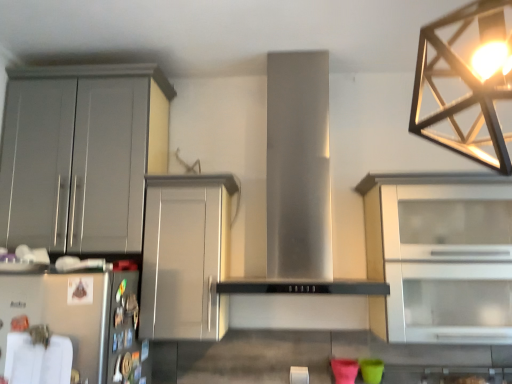
Question: Is satin silver cabinet at center, the second cabinetry when ordered from left to right, in front of or behind white glass cabinet at right, which is the 3th cabinetry in left-to-right order, in the image?

Choices:
 (A) behind
 (B) front

Answer: (A)

Question: Considering the positions of satin silver cabinet at center, which ranks as the 2th cabinetry in right-to-left order, and white glass cabinet at right, which is the 3th cabinetry in left-to-right order, in the image, is satin silver cabinet at center, which ranks as the 2th cabinetry in right-to-left order, bigger or smaller than white glass cabinet at right, which is the 3th cabinetry in left-to-right order,?

Choices:
 (A) small
 (B) big

Answer: (A)

Question: Estimate the real-world distances between objects in this image. Which object is closer to the metallic geometric light fixture at upper right?

Choices:
 (A) satin silver cabinet at center, the second cabinetry when ordered from left to right
 (B) white glass cabinet at right, which is the first cabinetry in right-to-left order
 (C) matte gray cabinet at left, the first cabinetry in the left-to-right sequence
 (D) stainless steel hood at center

Answer: (B)

Question: Which of these objects is positioned closest to the satin silver cabinet at center, the second cabinetry when ordered from left to right?

Choices:
 (A) metallic geometric light fixture at upper right
 (B) stainless steel hood at center
 (C) matte gray cabinet at left, placed as the 3th cabinetry when sorted from right to left
 (D) white glass cabinet at right, which is the first cabinetry in right-to-left order

Answer: (C)